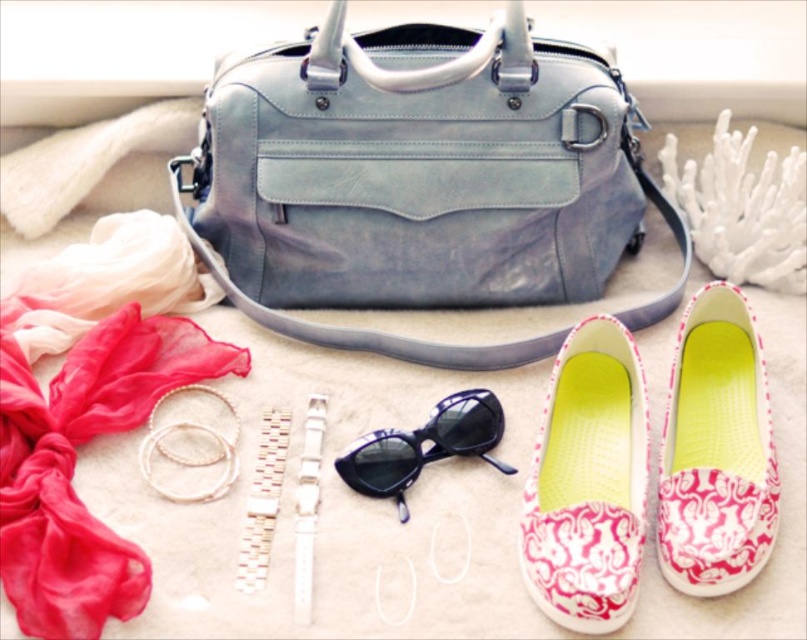
Question: Which object is closer to the camera taking this photo?

Choices:
 (A) black plastic sunglasses at center
 (B) pink printed fabric slip-on shoes at lower right

Answer: (B)

Question: Based on their relative distances, which object is nearer to the pink printed fabric slip-on shoes at lower right?

Choices:
 (A) pink damask slip-on shoes at lower right
 (B) matte blue leather bag at upper center
 (C) black plastic sunglasses at center
 (D) silky chiffon scarf at upper left

Answer: (A)

Question: Can you confirm if matte blue leather bag at upper center is positioned to the left of pink printed fabric slip-on shoes at lower right?

Choices:
 (A) no
 (B) yes

Answer: (B)

Question: Is silky chiffon scarf at upper left further to camera compared to pink damask slip-on shoes at lower right?

Choices:
 (A) no
 (B) yes

Answer: (A)

Question: Is matte blue leather bag at upper center closer to camera compared to silky chiffon scarf at upper left?

Choices:
 (A) no
 (B) yes

Answer: (A)

Question: Which is nearer to the silky chiffon scarf at upper left?

Choices:
 (A) black plastic sunglasses at center
 (B) matte blue leather bag at upper center

Answer: (A)